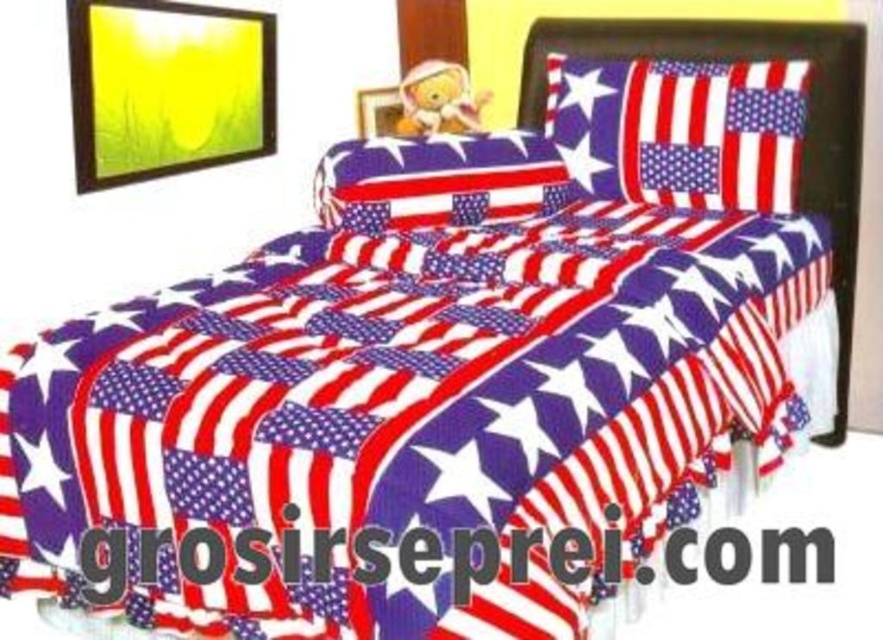
Question: Which is nearer to the wooden picture frame at upper left?

Choices:
 (A) american flag fabric pillow at center
 (B) metallic gold picture frame at upper center
 (C) american flag fabric at upper right

Answer: (B)

Question: Does american flag fabric pillow at center appear on the right side of metallic gold picture frame at upper center?

Choices:
 (A) yes
 (B) no

Answer: (A)

Question: Based on their relative distances, which object is nearer to the american flag fabric at upper right?

Choices:
 (A) wooden picture frame at upper left
 (B) metallic gold picture frame at upper center

Answer: (B)

Question: Is american flag fabric at upper right thinner than american flag fabric pillow at center?

Choices:
 (A) yes
 (B) no

Answer: (A)

Question: Which point is closer to the camera taking this photo?

Choices:
 (A) (741, 157)
 (B) (149, 10)

Answer: (B)

Question: In this image, where is american flag fabric at upper right located relative to metallic gold picture frame at upper center?

Choices:
 (A) right
 (B) left

Answer: (A)